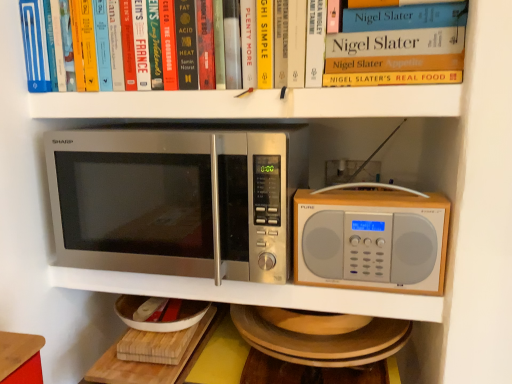
Question: Can you confirm if stainless steel microwave at left, placed as the second microwave oven when sorted from right to left, is smaller than wooden cutting board at lower center?

Choices:
 (A) yes
 (B) no

Answer: (B)

Question: Does stainless steel microwave at left, placed as the second microwave oven when sorted from right to left, lie behind wooden cutting board at lower center?

Choices:
 (A) no
 (B) yes

Answer: (A)

Question: From the image's perspective, is stainless steel microwave at left, marked as the 1th microwave oven in a left-to-right arrangement, located beneath wooden cutting board at lower center?

Choices:
 (A) no
 (B) yes

Answer: (A)

Question: Is stainless steel microwave at left, marked as the 1th microwave oven in a left-to-right arrangement, aimed at wooden cutting board at lower center?

Choices:
 (A) no
 (B) yes

Answer: (A)

Question: In the image, is wooden cutting board at lower center positioned in front of or behind hardcover book at upper center?

Choices:
 (A) behind
 (B) front

Answer: (A)

Question: Considering the positions of wooden cutting board at lower center and hardcover book at upper center in the image, is wooden cutting board at lower center bigger or smaller than hardcover book at upper center?

Choices:
 (A) small
 (B) big

Answer: (A)

Question: Would you say wooden cutting board at lower center is to the left or to the right of hardcover book at upper center in the picture?

Choices:
 (A) left
 (B) right

Answer: (A)

Question: Considering the positions of point (147, 365) and point (429, 62), is point (147, 365) closer or farther from the camera than point (429, 62)?

Choices:
 (A) closer
 (B) farther

Answer: (B)

Question: In terms of width, does hardcover book at upper center look wider or thinner when compared to silver metallic microwave at center, which is counted as the first microwave oven, starting from the right?

Choices:
 (A) thin
 (B) wide

Answer: (B)

Question: Looking at the image, does hardcover book at upper center seem bigger or smaller compared to silver metallic microwave at center, which is counted as the first microwave oven, starting from the right?

Choices:
 (A) big
 (B) small

Answer: (A)

Question: From a real-world perspective, is hardcover book at upper center above or below silver metallic microwave at center, which is counted as the first microwave oven, starting from the right?

Choices:
 (A) below
 (B) above

Answer: (B)

Question: Is hardcover book at upper center in front of or behind silver metallic microwave at center, which is counted as the first microwave oven, starting from the right, in the image?

Choices:
 (A) front
 (B) behind

Answer: (A)

Question: Visually, is hardcover book at upper center positioned to the left or to the right of wooden cutting board at lower center?

Choices:
 (A) left
 (B) right

Answer: (B)

Question: Is hardcover book at upper center wider or thinner than wooden cutting board at lower center?

Choices:
 (A) wide
 (B) thin

Answer: (B)